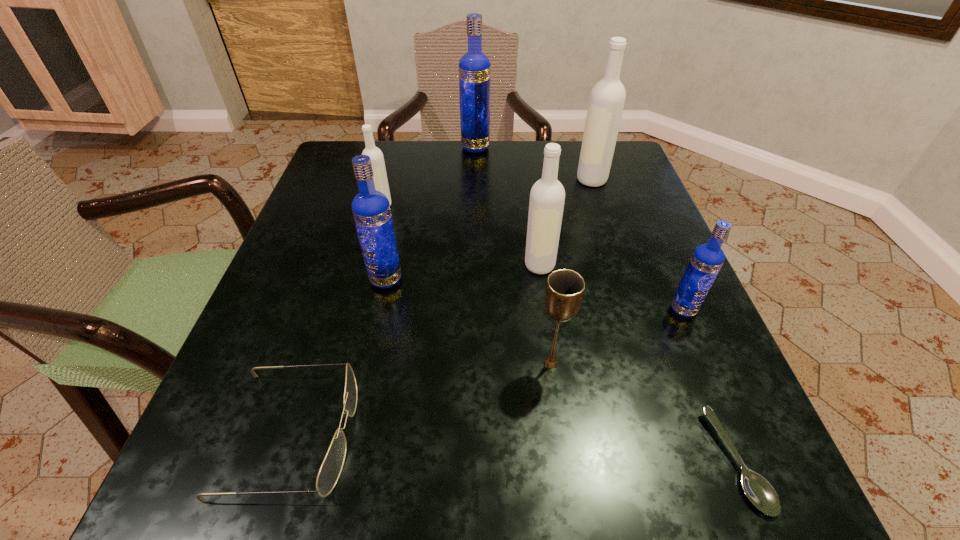
This screenshot has width=960, height=540. What are the coordinates of `object that is at the near left corner` in the screenshot? It's located at (331, 468).

The width and height of the screenshot is (960, 540). Find the location of `object positioned at the far right corner`. object positioned at the far right corner is located at coordinates (607, 98).

You are a GUI agent. You are given a task and a screenshot of the screen. Output one action in this format:
    pyautogui.click(x=<x>, y=<y>)
    Task: Click on the object positioned at the near right corner
    
    Given the screenshot: What is the action you would take?
    pyautogui.click(x=759, y=491)

This screenshot has height=540, width=960. What are the coordinates of `vacant space at the far edge of the desktop` in the screenshot? It's located at (428, 167).

Identify the location of vacant space at the near edge of the desktop. The image size is (960, 540). (514, 450).

Find the location of a particular element. vacant space at the left edge of the desktop is located at coordinates (348, 225).

In the image, there is a desktop. Identify the location of vacant area at the right edge. (679, 319).

This screenshot has width=960, height=540. Identify the location of free spot at the far right corner of the desktop. click(x=633, y=173).

This screenshot has height=540, width=960. I want to click on vacant space at the near right corner, so click(725, 524).

Where is `free area in between the third vodka from left to right and the chalice`? The width and height of the screenshot is (960, 540). free area in between the third vodka from left to right and the chalice is located at coordinates (514, 255).